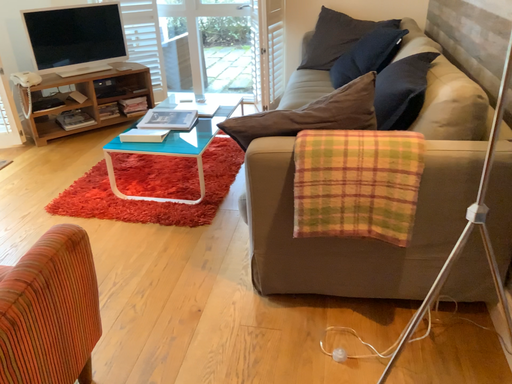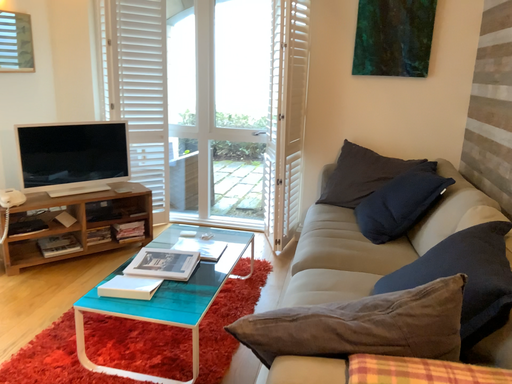
Question: Which way did the camera rotate in the video?

Choices:
 (A) rotated upward
 (B) rotated downward

Answer: (A)